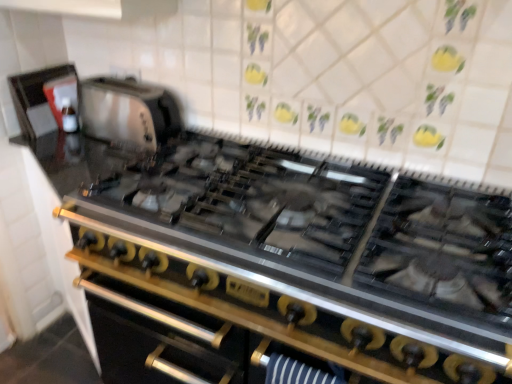
Question: From the image's perspective, is stainless steel oven at center above stainless steel gas stove at center?

Choices:
 (A) no
 (B) yes

Answer: (A)

Question: Is the depth of stainless steel oven at center greater than that of stainless steel gas stove at center?

Choices:
 (A) yes
 (B) no

Answer: (A)

Question: Is stainless steel oven at center oriented towards stainless steel gas stove at center?

Choices:
 (A) no
 (B) yes

Answer: (A)

Question: From a real-world perspective, is stainless steel oven at center located higher than stainless steel gas stove at center?

Choices:
 (A) yes
 (B) no

Answer: (B)

Question: From the image's perspective, does stainless steel oven at center appear lower than stainless steel gas stove at center?

Choices:
 (A) yes
 (B) no

Answer: (A)

Question: Is stainless steel gas stove at center located within stainless steel oven at center?

Choices:
 (A) no
 (B) yes

Answer: (A)

Question: Can you confirm if satin silver toaster at upper left, which is counted as the second appliance, starting from the left, is wider than stainless steel oven at center?

Choices:
 (A) yes
 (B) no

Answer: (B)

Question: From the image's perspective, is satin silver toaster at upper left, which appears as the first appliance when viewed from the right, beneath stainless steel oven at center?

Choices:
 (A) yes
 (B) no

Answer: (B)

Question: Does satin silver toaster at upper left, which appears as the first appliance when viewed from the right, have a larger size compared to stainless steel oven at center?

Choices:
 (A) no
 (B) yes

Answer: (A)

Question: Is satin silver toaster at upper left, which appears as the first appliance when viewed from the right, at the right side of stainless steel oven at center?

Choices:
 (A) yes
 (B) no

Answer: (B)

Question: Does satin silver toaster at upper left, which is counted as the second appliance, starting from the left, have a lesser width compared to stainless steel oven at center?

Choices:
 (A) no
 (B) yes

Answer: (B)

Question: Can you confirm if satin silver toaster at upper left, which appears as the first appliance when viewed from the right, is taller than stainless steel oven at center?

Choices:
 (A) yes
 (B) no

Answer: (B)

Question: Does matte black kettle at upper left, marked as the 2th appliance in a right-to-left arrangement, have a smaller size compared to satin silver toaster at upper left, which appears as the first appliance when viewed from the right?

Choices:
 (A) no
 (B) yes

Answer: (B)